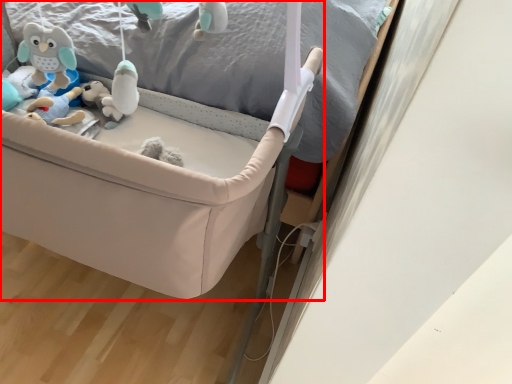
Question: From the image's perspective, where is infant bed (annotated by the red box) located in relation to bed frame in the image?

Choices:
 (A) below
 (B) above

Answer: (A)